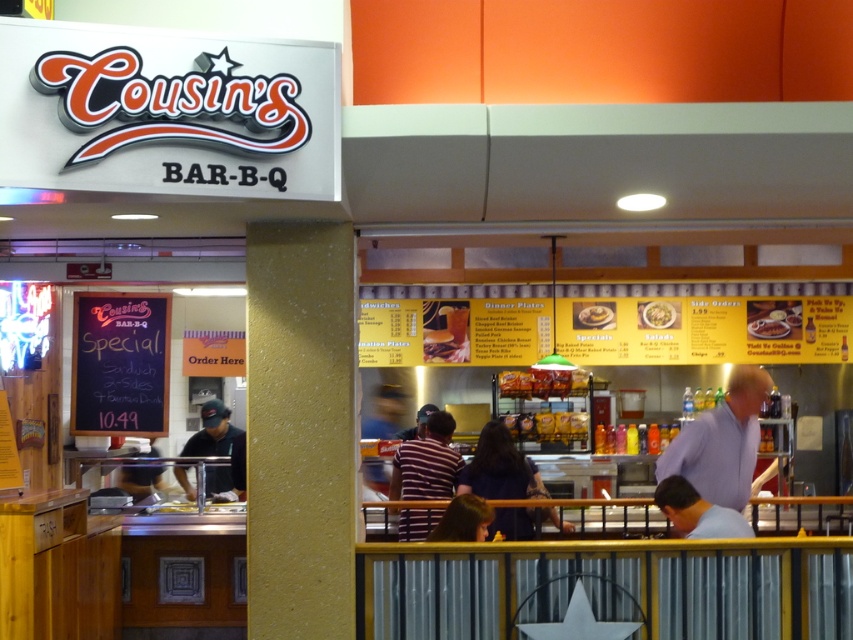
You are a delivery person who needs to pick up an order from Cousin BAR B Q. The order includes both the golden crispy chicken at center and the yellow matte pancake at center. Your carrying container can only hold items placed within 1.5 meters of each other. Will you be able to place both items in the container without moving them?

The golden crispy chicken at center and the yellow matte pancake at center are 1.67 meters apart, which exceeds the container capacity of 1.5 meters. Therefore, you cannot place both items in the container without moving them.